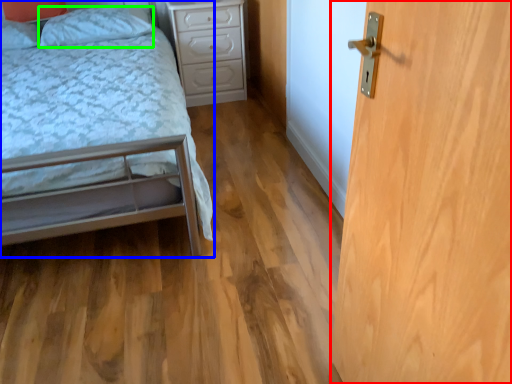
Question: Which object is positioned farthest from door (highlighted by a red box)? Select from bed (highlighted by a blue box) and pillow (highlighted by a green box).

Choices:
 (A) bed
 (B) pillow

Answer: (B)